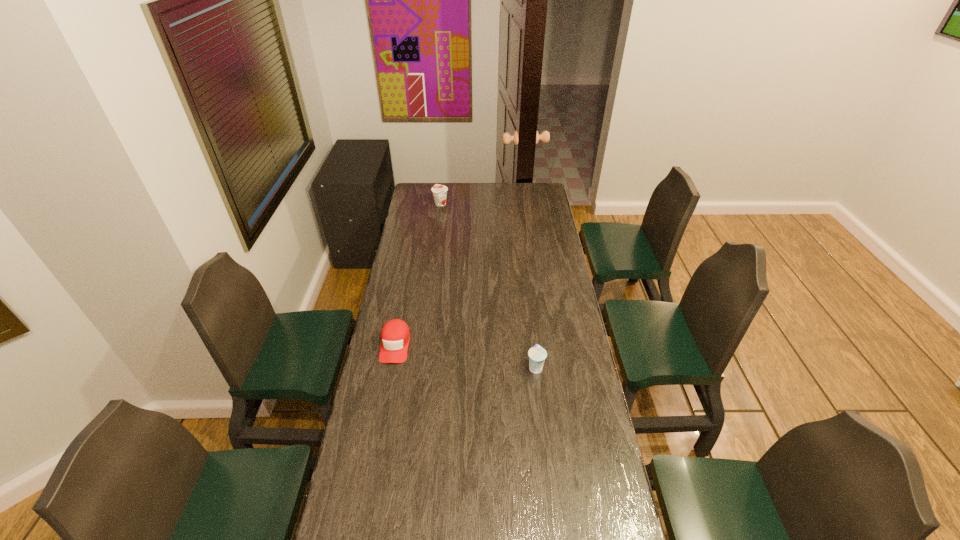
Locate an element on the screen. This screenshot has height=540, width=960. baseball cap that is positioned at the left edge is located at coordinates (395, 335).

Identify the location of object that is positioned at the far left corner. The image size is (960, 540). (439, 191).

At what (x,y) coordinates should I click in order to perform the action: click on free point at the far edge. Please return your answer as a coordinate pair (x, y). The image size is (960, 540). Looking at the image, I should click on (505, 202).

The image size is (960, 540). In the image, there is a desktop. Find the location of `vacant space at the left edge`. vacant space at the left edge is located at coordinates (428, 223).

Where is `free space at the right edge of the desktop`? This screenshot has width=960, height=540. free space at the right edge of the desktop is located at coordinates (569, 400).

Where is `free space at the far left corner`? The height and width of the screenshot is (540, 960). free space at the far left corner is located at coordinates (437, 184).

Image resolution: width=960 pixels, height=540 pixels. What are the coordinates of `empty location between the baseball cap and the rightmost object` in the screenshot? It's located at (466, 356).

Where is `vacant space that's between the farther yogurt and the right yogurt`? vacant space that's between the farther yogurt and the right yogurt is located at coordinates (488, 286).

At what (x,y) coordinates should I click in order to perform the action: click on vacant region between the second object from left to right and the baseball cap. Please return your answer as a coordinate pair (x, y). This screenshot has width=960, height=540. Looking at the image, I should click on (418, 274).

Identify the location of empty space that is in between the leftmost object and the left yogurt. This screenshot has height=540, width=960. (418, 274).